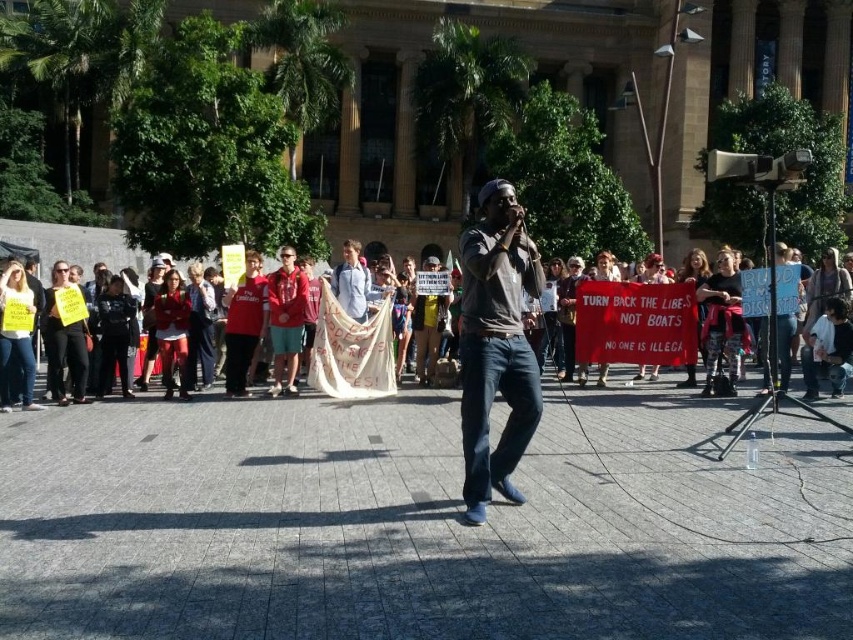
Between matte gray shirt at center and white cotton banner at center, which one has more height?

matte gray shirt at center

Is matte gray shirt at center thinner than white cotton banner at center?

Correct, matte gray shirt at center's width is less than white cotton banner at center's.

Locate an element on the screen. Image resolution: width=853 pixels, height=640 pixels. matte gray shirt at center is located at coordinates (496, 346).

Identify the location of matte gray shirt at center. The image size is (853, 640). (496, 346).